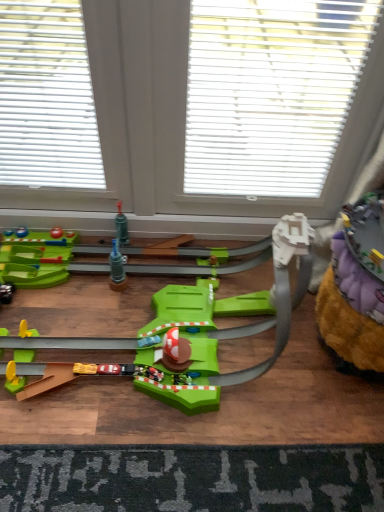
Question: Can you confirm if white plastic window at center is positioned to the left of green plastic track at center, the 2th toy viewed from the right?

Choices:
 (A) yes
 (B) no

Answer: (B)

Question: From the image's perspective, would you say white plastic window at center is shown under green plastic track at center, the 2th toy viewed from the right?

Choices:
 (A) yes
 (B) no

Answer: (B)

Question: From a real-world perspective, is white plastic window at center located beneath green plastic track at center, the 1th toy when ordered from left to right?

Choices:
 (A) no
 (B) yes

Answer: (A)

Question: Can you confirm if white plastic window at center is taller than green plastic track at center, the 2th toy viewed from the right?

Choices:
 (A) yes
 (B) no

Answer: (A)

Question: Would you say white plastic window at center is a long distance from green plastic track at center, the 1th toy when ordered from left to right?

Choices:
 (A) yes
 (B) no

Answer: (B)

Question: Can we say white plastic window at center lies outside green plastic track at center, the 2th toy viewed from the right?

Choices:
 (A) no
 (B) yes

Answer: (B)

Question: Is green plastic track at center, the 1th toy when ordered from left to right, next to dark gray textured mat at lower center?

Choices:
 (A) yes
 (B) no

Answer: (B)

Question: From the image's perspective, is green plastic track at center, the 1th toy when ordered from left to right, over dark gray textured mat at lower center?

Choices:
 (A) yes
 (B) no

Answer: (A)

Question: Is green plastic track at center, the 2th toy viewed from the right, aimed at dark gray textured mat at lower center?

Choices:
 (A) no
 (B) yes

Answer: (B)

Question: Considering the relative sizes of green plastic track at center, the 1th toy when ordered from left to right, and dark gray textured mat at lower center in the image provided, is green plastic track at center, the 1th toy when ordered from left to right, bigger than dark gray textured mat at lower center?

Choices:
 (A) yes
 (B) no

Answer: (A)

Question: Does green plastic track at center, the 1th toy when ordered from left to right, come in front of dark gray textured mat at lower center?

Choices:
 (A) yes
 (B) no

Answer: (A)

Question: Is green plastic track at center, the 2th toy viewed from the right, turned away from dark gray textured mat at lower center?

Choices:
 (A) no
 (B) yes

Answer: (A)

Question: Is white plastic window at center a part of white plastic blinds at upper center?

Choices:
 (A) no
 (B) yes

Answer: (A)